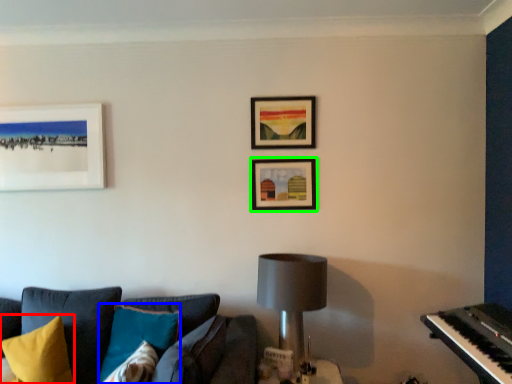
Question: Based on their relative distances, which object is nearer to pillow (highlighted by a red box)? Choose from pillow (highlighted by a blue box) and picture frame (highlighted by a green box).

Choices:
 (A) pillow
 (B) picture frame

Answer: (A)